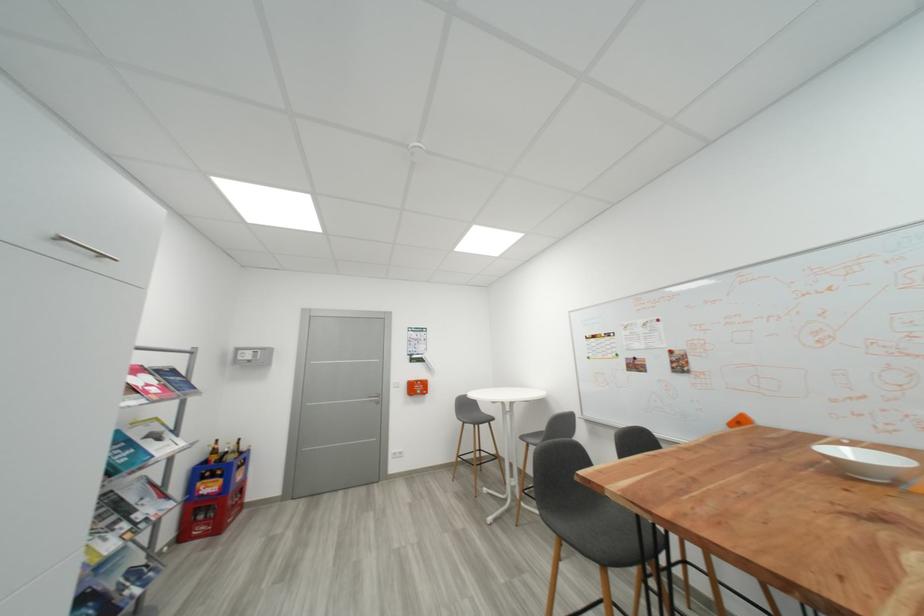
Locate an element on the screen. silver cabinet handle is located at coordinates (83, 246).